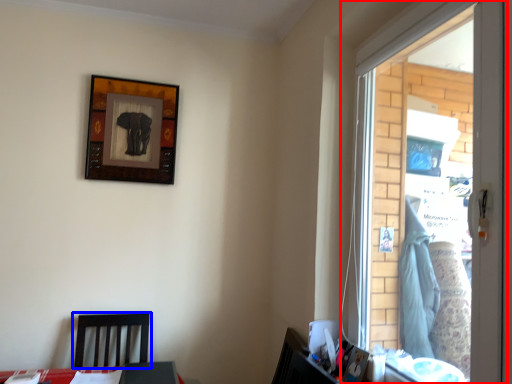
Question: Which point is closer to the camera, window (highlighted by a red box) or furniture (highlighted by a blue box)?

Choices:
 (A) window
 (B) furniture

Answer: (A)